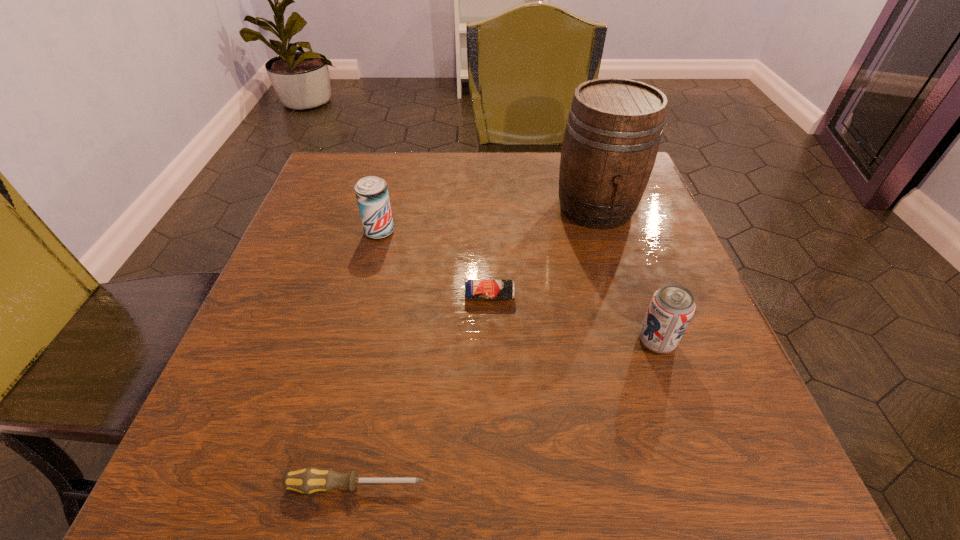
The height and width of the screenshot is (540, 960). I want to click on free space that is in between the leftmost beer can and the shortest beer can, so click(435, 264).

Locate an element on the screen. free spot between the tallest object and the rightmost beer can is located at coordinates click(626, 274).

What are the coordinates of `free space between the tallest object and the screwdriver` in the screenshot? It's located at (476, 347).

Locate an element on the screen. This screenshot has width=960, height=540. empty space between the tallest object and the third object from left to right is located at coordinates (542, 252).

Identify the location of free space that is in between the rightmost beer can and the nearest object. (506, 413).

The width and height of the screenshot is (960, 540). Identify the location of free space between the cider and the nearest object. (476, 347).

Where is `the third closest object to the tallest object`? the third closest object to the tallest object is located at coordinates (371, 192).

Identify which object is the fourth nearest to the cider. Please provide its 2D coordinates. Your answer should be formatted as a tuple, i.e. [(x, y)], where the tuple contains the x and y coordinates of a point satisfying the conditions above.

[(308, 480)]

Select which beer can is the closest to the farthest beer can. Please provide its 2D coordinates. Your answer should be formatted as a tuple, i.e. [(x, y)], where the tuple contains the x and y coordinates of a point satisfying the conditions above.

[(473, 289)]

Identify which beer can is the second nearest to the cider. Please provide its 2D coordinates. Your answer should be formatted as a tuple, i.e. [(x, y)], where the tuple contains the x and y coordinates of a point satisfying the conditions above.

[(671, 308)]